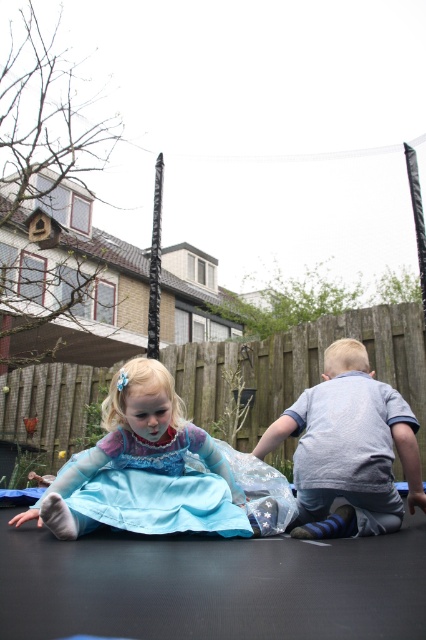
Consider the image. Based on the coordinates provided, which object is located at point (141,464) in the image?

The point (141,464) corresponds to the blue satin dress at center.